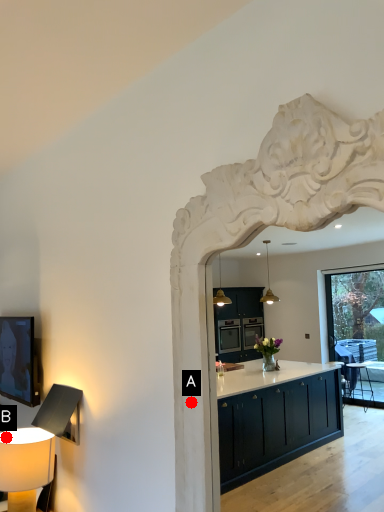
Question: Two points are circled on the image, labeled by A and B beside each circle. Among these points, which one is nearest to the camera?

Choices:
 (A) A is closer
 (B) B is closer

Answer: (A)